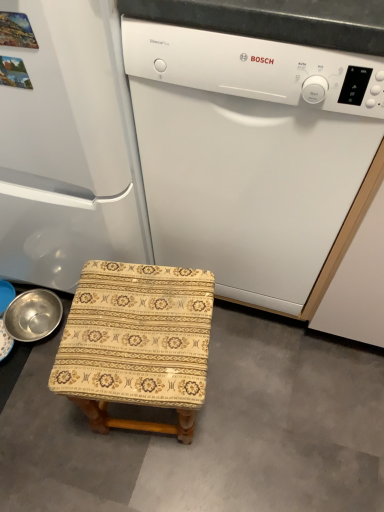
I want to click on vacant point to the left of patterned fabric stool at center, so click(x=46, y=432).